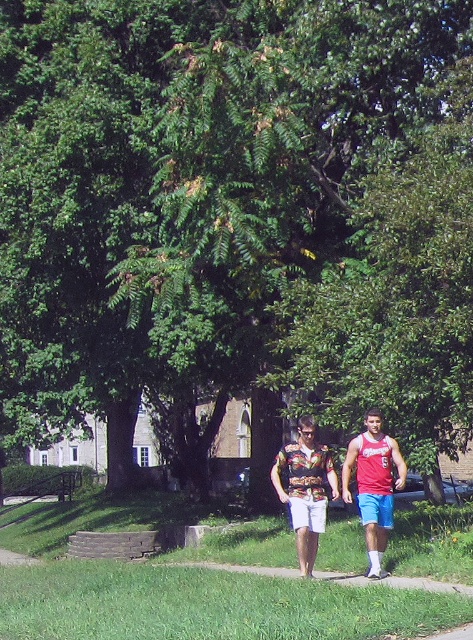
Is red fabric tank top at center thinner than hawaiian print shirt at center?

In fact, red fabric tank top at center might be wider than hawaiian print shirt at center.

Which is more to the right, red fabric tank top at center or hawaiian print shirt at center?

red fabric tank top at center is more to the right.

Which is in front, point (401, 454) or point (281, 458)?

Point (281, 458) is in front.

Where is `red fabric tank top at center`? This screenshot has width=473, height=640. red fabric tank top at center is located at coordinates (374, 484).

The width and height of the screenshot is (473, 640). In order to click on floral fabric shirt at center in this screenshot , I will do `click(374, 484)`.

Identify the location of floral fabric shirt at center. (374, 484).

Does floral fabric shirt at center appear under red fabric tank top at center?

Indeed, floral fabric shirt at center is positioned under red fabric tank top at center.

Consider the image. Can you confirm if floral fabric shirt at center is thinner than red fabric tank top at center?

No.

Is point (373, 532) positioned in front of point (386, 525)?

No, (373, 532) is behind (386, 525).

You are a GUI agent. You are given a task and a screenshot of the screen. Output one action in this format:
    pyautogui.click(x=<x>, y=<y>)
    Task: Click on the floral fabric shirt at center
    
    Given the screenshot: What is the action you would take?
    [x=374, y=484]